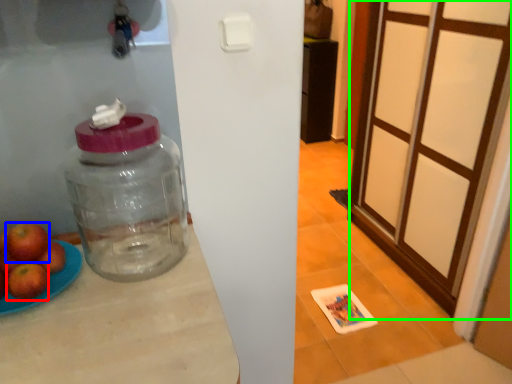
Question: Which is nearer to the apple (highlighted by a red box)? apple (highlighted by a blue box) or screen door (highlighted by a green box).

Choices:
 (A) apple
 (B) screen door

Answer: (A)